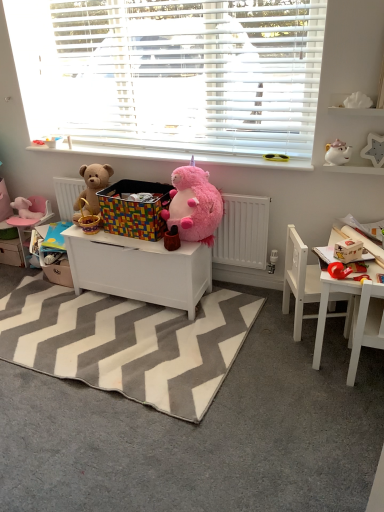
Question: Would you say gray zigzag rug at center is inside or outside white glossy teapot at upper right, acting as the 3th toy starting from the left?

Choices:
 (A) inside
 (B) outside

Answer: (B)

Question: From a real-world perspective, is gray zigzag rug at center physically located above or below white glossy teapot at upper right, the third toy viewed from the front?

Choices:
 (A) below
 (B) above

Answer: (A)

Question: Estimate the real-world distances between objects in this image. Which object is farther from the gray zigzag rug at center?

Choices:
 (A) brushed metal drawer at lower left
 (B) white glossy table at right, which is the 2th table in left-to-right order
 (C) multicolored plastic crate at center
 (D) white wooden chair at lower right, positioned as the 1th chair in back-to-front order
 (E) white plastic chair at right, arranged as the first chair when viewed from the front

Answer: (A)

Question: Which object is the farthest from the gray zigzag rug at center?

Choices:
 (A) white plastic radiator at center
 (B) white plastic blinds at upper center
 (C) white matte toy chest at center, placed as the 1th table when sorted from left to right
 (D) pink plush toy at left, positioned as the 5th toy in front-to-back order
 (E) white plastic chair at right, arranged as the first chair when viewed from the front

Answer: (D)